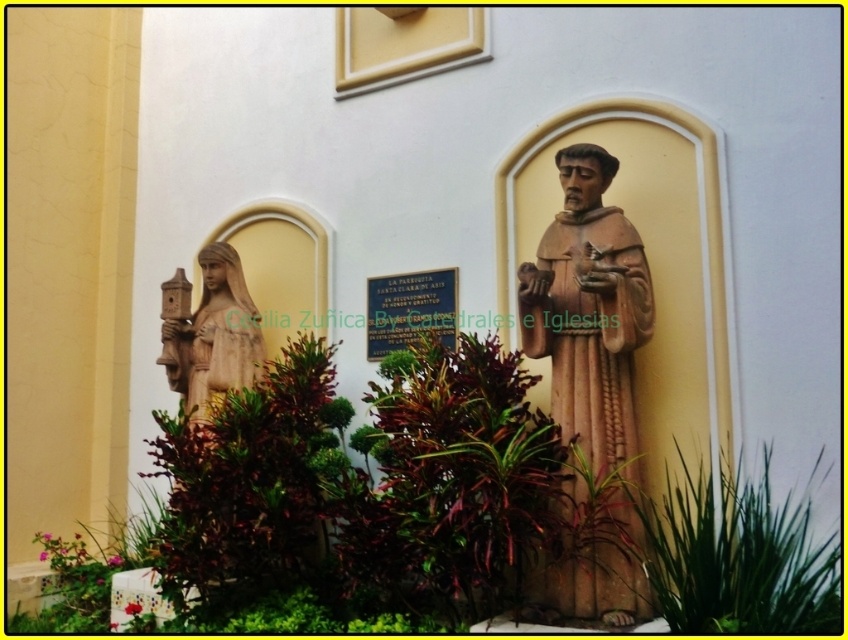
Does green leafy plant at center lie in front of wooden statue at left?

Yes, it is.

This screenshot has height=640, width=848. What are the coordinates of `green leafy plant at center` in the screenshot? It's located at (738, 556).

Is matte brown statue at center further to camera compared to wooden statue at left?

No, matte brown statue at center is closer to the viewer.

Is point (620, 602) closer to camera compared to point (204, 262)?

Yes, it is in front of point (204, 262).

Between point (556, 570) and point (179, 344), which one is positioned behind?

Positioned behind is point (179, 344).

Find the location of a particular element. Image resolution: width=848 pixels, height=640 pixels. matte brown statue at center is located at coordinates (589, 312).

Which is in front, point (561, 310) or point (723, 513)?

Point (723, 513) is more forward.

Is point (622, 612) less distant than point (766, 483)?

Yes, it is.

Describe the element at coordinates (589, 312) in the screenshot. I see `matte brown statue at center` at that location.

Find the location of a particular element. matte brown statue at center is located at coordinates (589, 312).